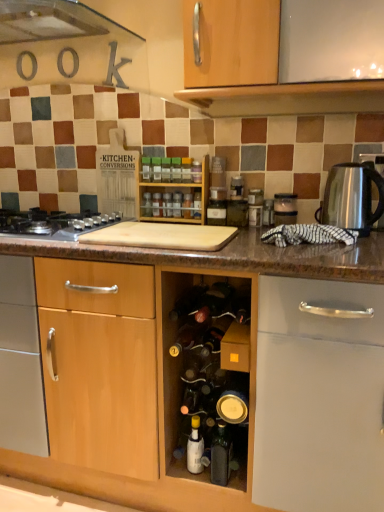
Question: Should I look upward or downward to see green plastic spice at center, the 2th bottle from the top?

Choices:
 (A) down
 (B) up

Answer: (B)

Question: Can you confirm if green plastic spice at center, the 2th bottle from the top, is wider than satin silver kettle at right?

Choices:
 (A) yes
 (B) no

Answer: (B)

Question: From a real-world perspective, is green plastic spice at center, arranged as the 10th bottle when ordered from the bottom, on top of satin silver kettle at right?

Choices:
 (A) no
 (B) yes

Answer: (B)

Question: Can you confirm if green plastic spice at center, arranged as the 10th bottle when ordered from the bottom, is smaller than satin silver kettle at right?

Choices:
 (A) yes
 (B) no

Answer: (A)

Question: Is green plastic spice at center, the 2th bottle from the top, at the left side of satin silver kettle at right?

Choices:
 (A) no
 (B) yes

Answer: (B)

Question: Is green plastic spice at center, the 2th bottle from the top, located outside satin silver kettle at right?

Choices:
 (A) yes
 (B) no

Answer: (A)

Question: Considering the relative sizes of green plastic spice at center, the 2th bottle from the top, and satin silver kettle at right in the image provided, is green plastic spice at center, the 2th bottle from the top, bigger than satin silver kettle at right?

Choices:
 (A) no
 (B) yes

Answer: (A)

Question: From the image's perspective, is translucent glass spice at center, arranged as the 7th bottle when ordered from the bottom, located beneath wooden spice rack at center?

Choices:
 (A) yes
 (B) no

Answer: (A)

Question: Is translucent glass spice at center, arranged as the 7th bottle when ordered from the bottom, positioned beyond the bounds of wooden spice rack at center?

Choices:
 (A) no
 (B) yes

Answer: (A)

Question: From the image's perspective, is translucent glass spice at center, arranged as the 7th bottle when ordered from the bottom, over wooden spice rack at center?

Choices:
 (A) yes
 (B) no

Answer: (B)

Question: Considering the relative sizes of translucent glass spice at center, arranged as the 7th bottle when ordered from the bottom, and wooden spice rack at center in the image provided, is translucent glass spice at center, arranged as the 7th bottle when ordered from the bottom, bigger than wooden spice rack at center?

Choices:
 (A) yes
 (B) no

Answer: (B)

Question: Is translucent glass spice at center, arranged as the 7th bottle when ordered from the bottom, not close to wooden spice rack at center?

Choices:
 (A) no
 (B) yes

Answer: (A)

Question: Is translucent glass spice at center, arranged as the 7th bottle when ordered from the bottom, thinner than wooden spice rack at center?

Choices:
 (A) no
 (B) yes

Answer: (B)

Question: Does green plastic spice at center, arranged as the 10th bottle when ordered from the bottom, contain silver metallic gas stove at left?

Choices:
 (A) no
 (B) yes

Answer: (A)